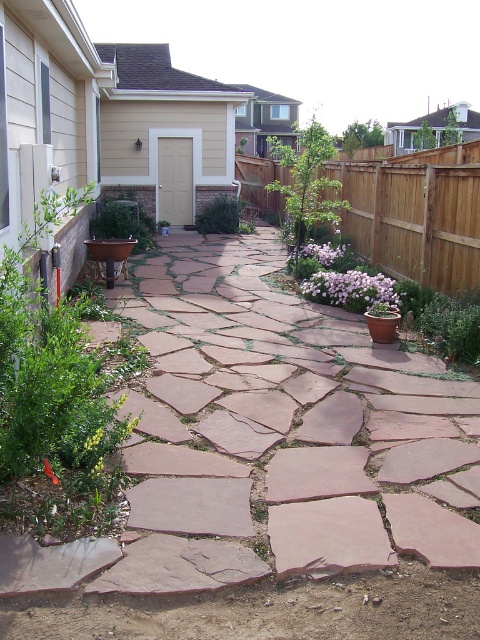
You are a gardener who wants to plant a new flower in the backyard garden. You have a pink matte flower at center and a green leafy plant at center. Which one requires more space between plants to grow properly?

The green leafy plant at center requires more space between plants to grow properly because its width is larger than the pink matte flower at center.

You are standing in the backyard garden and want to walk from the house door to the wheelbarrow. Which point, point (468,285) or point (108,205), is closer to you as you start walking towards the wheelbarrow?

Point (468,285) is closer to the viewer than point (108,205), so it would be the closer point as you start walking towards the wheelbarrow.